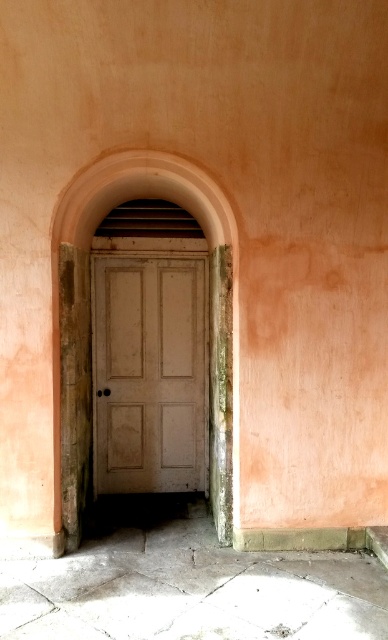
Does white matte door at center appear under smooth pink arch at center?

Yes.

Between white matte door at center and smooth pink arch at center, which one appears on the right side from the viewer's perspective?

From the viewer's perspective, white matte door at center appears more on the right side.

Describe the element at coordinates (150, 372) in the screenshot. I see `white matte door at center` at that location.

Image resolution: width=388 pixels, height=640 pixels. I want to click on white matte door at center, so click(150, 372).